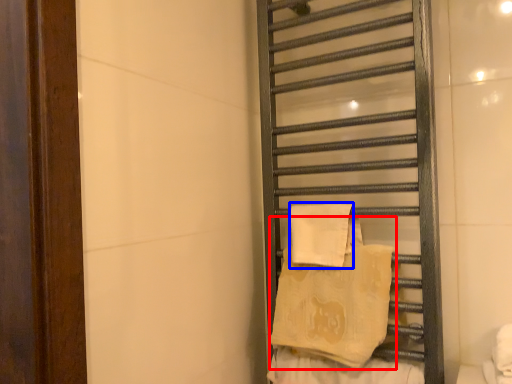
Question: Which object appears farthest to the camera in this image, beach towel (highlighted by a red box) or beach towel (highlighted by a blue box)?

Choices:
 (A) beach towel
 (B) beach towel

Answer: (B)